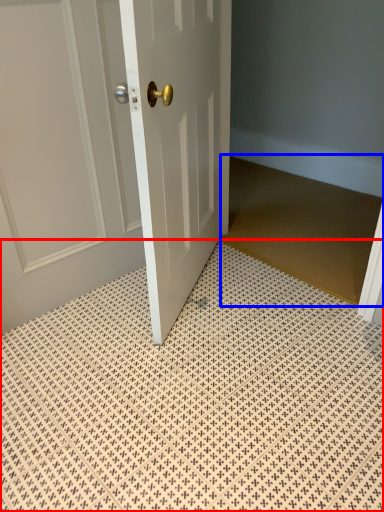
Question: Which object appears farthest to the camera in this image, bath mat (highlighted by a red box) or doormat (highlighted by a blue box)?

Choices:
 (A) bath mat
 (B) doormat

Answer: (B)